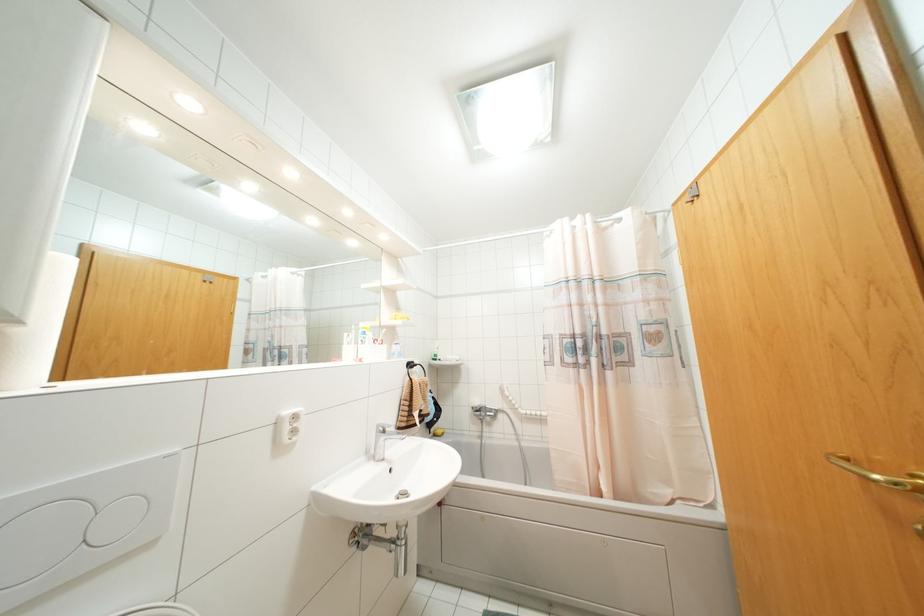
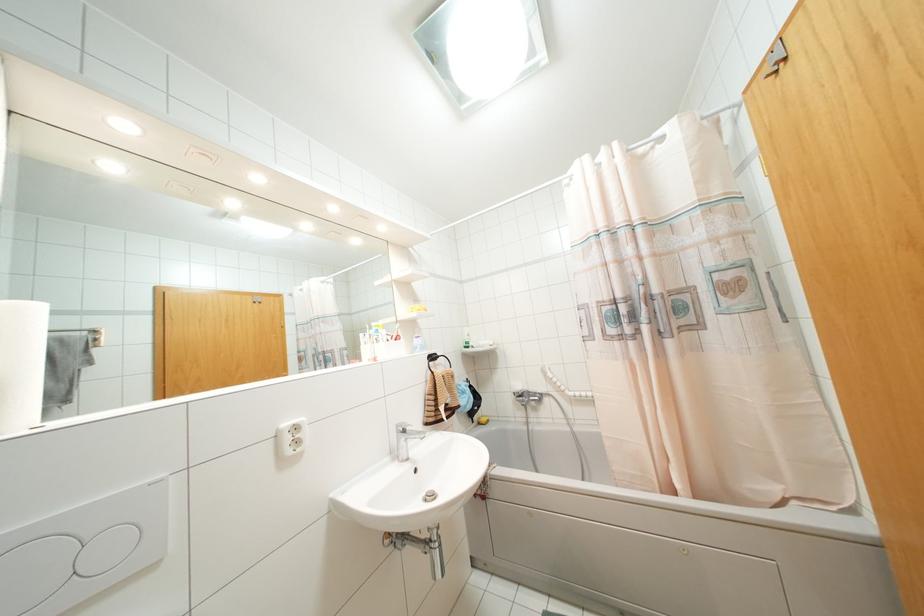
In the second image, find the point that corresponds to pixel 480 415 in the first image.

(523, 400)